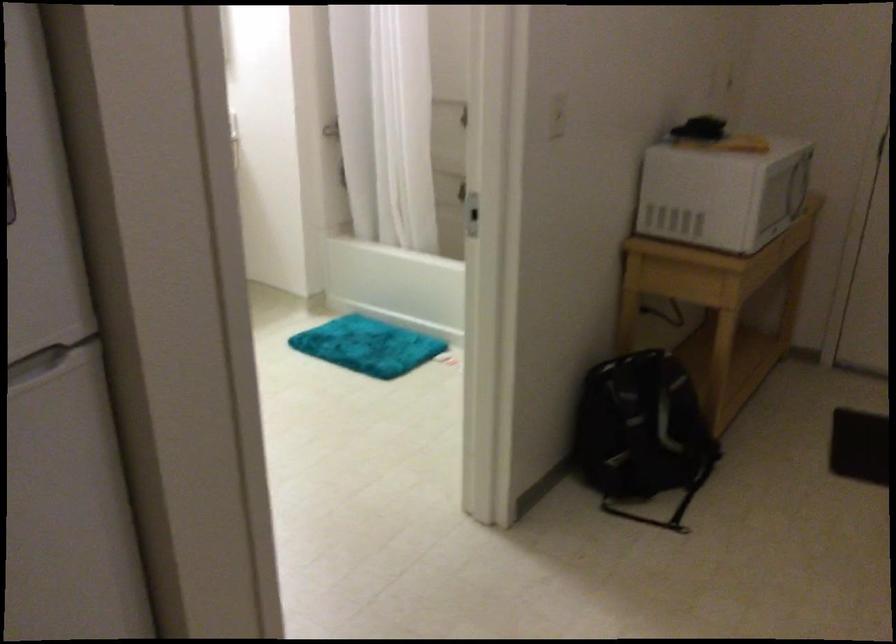
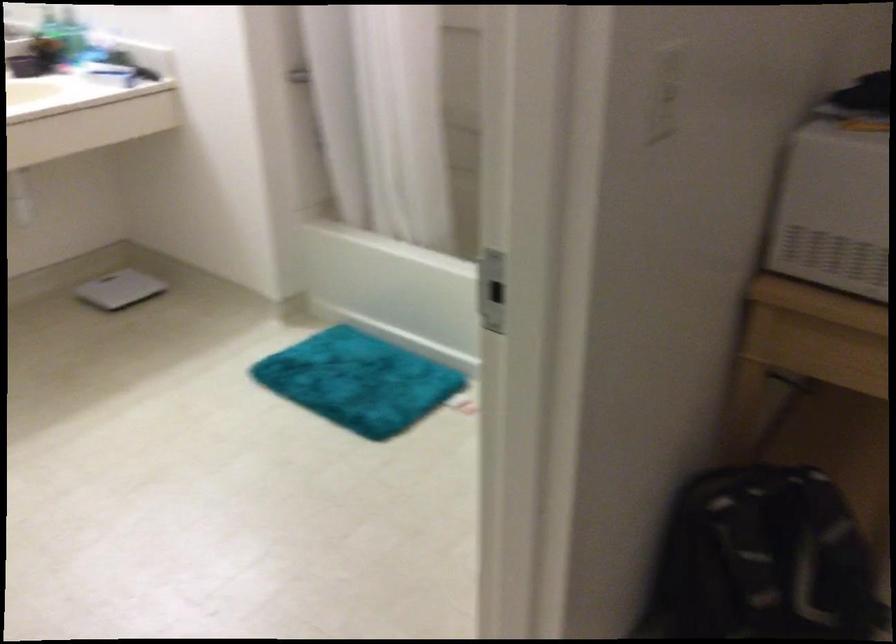
Find the pixel in the second image that matches (x=368, y=345) in the first image.

(358, 381)